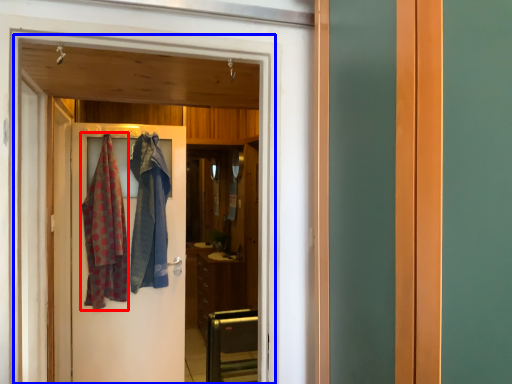
Question: Which point is further to the camera, clothing (highlighted by a red box) or elevator (highlighted by a blue box)?

Choices:
 (A) clothing
 (B) elevator

Answer: (A)